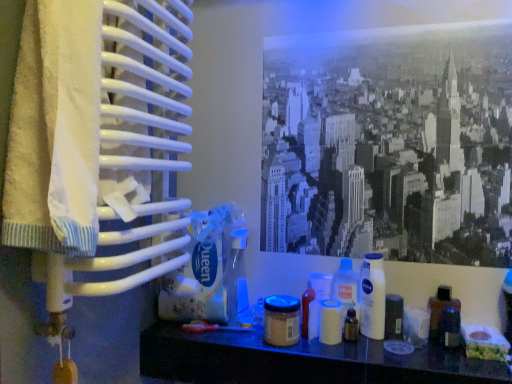
Question: From the image's perspective, is white plastic container at center, the fourth toiletry viewed from the left, located beneath monochrome cityscape at upper center?

Choices:
 (A) yes
 (B) no

Answer: (A)

Question: From the image's perspective, is white plastic container at center, positioned as the 4th toiletry in right-to-left order, on top of monochrome cityscape at upper center?

Choices:
 (A) no
 (B) yes

Answer: (A)

Question: Would you say white plastic container at center, positioned as the 4th toiletry in right-to-left order, is outside monochrome cityscape at upper center?

Choices:
 (A) no
 (B) yes

Answer: (B)

Question: Is white plastic container at center, positioned as the 4th toiletry in right-to-left order, positioned with its back to monochrome cityscape at upper center?

Choices:
 (A) yes
 (B) no

Answer: (B)

Question: Is monochrome cityscape at upper center inside white plastic container at center, the fourth toiletry viewed from the left?

Choices:
 (A) no
 (B) yes

Answer: (A)

Question: From their relative heights in the image, would you say translucent plastic bottle at lower right, the second bottle when ordered from left to right, is taller or shorter than white plastic container at center, positioned as the 4th toiletry in right-to-left order?

Choices:
 (A) tall
 (B) short

Answer: (B)

Question: Considering the positions of translucent plastic bottle at lower right, the first bottle when ordered from right to left, and white plastic container at center, positioned as the 4th toiletry in right-to-left order, in the image, is translucent plastic bottle at lower right, the first bottle when ordered from right to left, bigger or smaller than white plastic container at center, positioned as the 4th toiletry in right-to-left order,?

Choices:
 (A) small
 (B) big

Answer: (A)

Question: In the image, is translucent plastic bottle at lower right, the second bottle when ordered from left to right, positioned in front of or behind white plastic container at center, positioned as the 4th toiletry in right-to-left order?

Choices:
 (A) front
 (B) behind

Answer: (A)

Question: Is point (451, 297) closer or farther from the camera than point (312, 309)?

Choices:
 (A) closer
 (B) farther

Answer: (A)

Question: In terms of height, does matte plastic shelf at lower center look taller or shorter compared to translucent plastic bottle at lower right, the second bottle when ordered from left to right?

Choices:
 (A) tall
 (B) short

Answer: (B)

Question: Would you say matte plastic shelf at lower center is to the left or to the right of translucent plastic bottle at lower right, the first bottle when ordered from right to left, in the picture?

Choices:
 (A) right
 (B) left

Answer: (B)

Question: From the image's perspective, relative to translucent plastic bottle at lower right, the second bottle when ordered from left to right, is matte plastic shelf at lower center above or below?

Choices:
 (A) above
 (B) below

Answer: (B)

Question: Considering the positions of matte plastic shelf at lower center and translucent plastic bottle at lower right, the first bottle when ordered from right to left, in the image, is matte plastic shelf at lower center wider or thinner than translucent plastic bottle at lower right, the first bottle when ordered from right to left,?

Choices:
 (A) wide
 (B) thin

Answer: (A)

Question: From the image's perspective, is monochrome cityscape at upper center above or below translucent plastic tube at center, the fifth toiletry from the right?

Choices:
 (A) above
 (B) below

Answer: (A)

Question: Considering the relative positions of monochrome cityscape at upper center and translucent plastic tube at center, which is the third toiletry from left to right, in the image provided, is monochrome cityscape at upper center to the left or to the right of translucent plastic tube at center, which is the third toiletry from left to right,?

Choices:
 (A) left
 (B) right

Answer: (B)